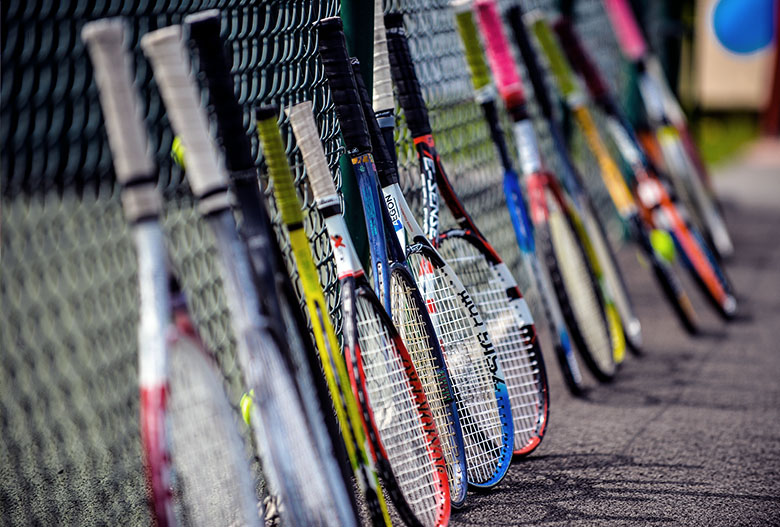
This screenshot has height=527, width=780. In order to click on handles in this screenshot , I will do `click(118, 145)`, `click(207, 148)`, `click(281, 182)`, `click(317, 158)`, `click(353, 125)`, `click(385, 102)`, `click(377, 146)`, `click(417, 113)`, `click(494, 126)`, `click(512, 105)`.